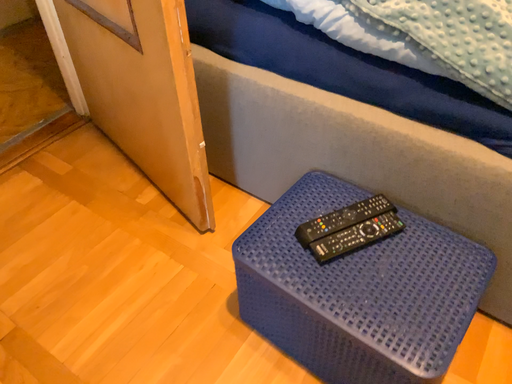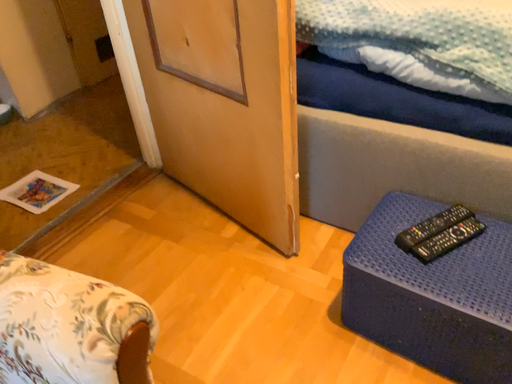
Question: How did the camera likely rotate when shooting the video?

Choices:
 (A) rotated upward
 (B) rotated downward

Answer: (A)